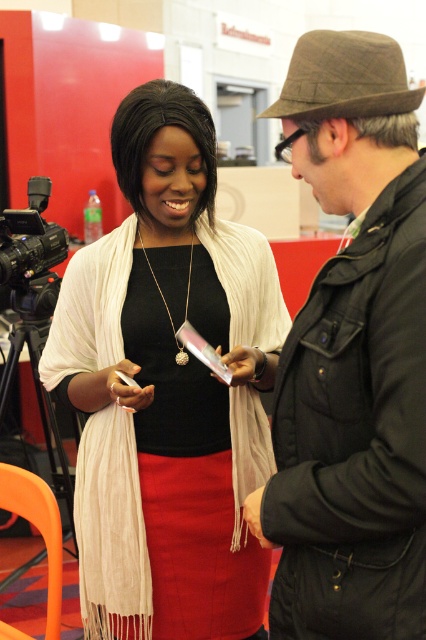
Looking at the scene, where is the matte white scarf at center in relation to the dark brown woolen hat at upper right?

The matte white scarf at center is to the left of the dark brown woolen hat at upper right.

Please describe the location of the matte white scarf at center in the image using coordinates. The coordinate system has the origin at the bottom left corner of the image, with the x and y axes increasing to the right and up respectively. The maximum x and y values are both 1.0. Please provide the coordinates as a tuple of two decimal numbers separated by a comma, rounded to three decimal places.

The matte white scarf at center is located at coordinates approximately equal to the point given in the description, so the answer is (x=167, y=388).